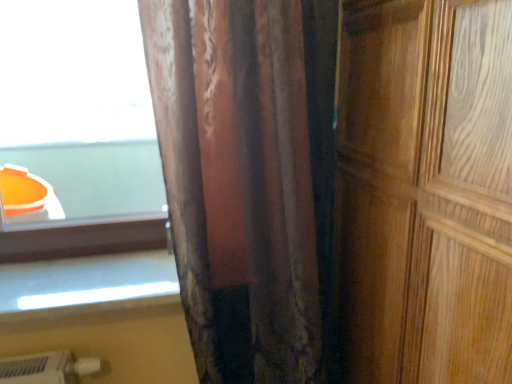
Question: Is white glossy window sill at lower left spatially inside wooden door at right, or outside of it?

Choices:
 (A) outside
 (B) inside

Answer: (A)

Question: From the image's perspective, relative to wooden door at right, is white glossy window sill at lower left above or below?

Choices:
 (A) above
 (B) below

Answer: (B)

Question: Which object is positioned closest to the wooden door at right?

Choices:
 (A) white glossy window sill at lower left
 (B) velvet-like brown curtain at center

Answer: (B)

Question: Which object is positioned closest to the white glossy window sill at lower left?

Choices:
 (A) wooden door at right
 (B) velvet-like brown curtain at center

Answer: (B)